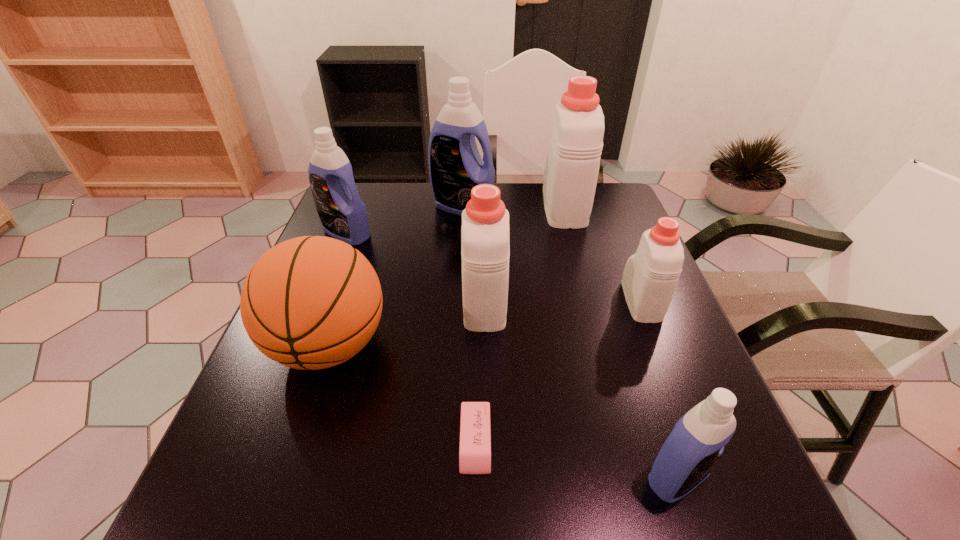
Where is `vacant area that lies between the rightmost white detergent and the second blue detergent from right to left`? The width and height of the screenshot is (960, 540). vacant area that lies between the rightmost white detergent and the second blue detergent from right to left is located at coordinates (552, 254).

Identify the location of free area in between the biggest blue detergent and the leftmost blue detergent. The width and height of the screenshot is (960, 540). (405, 220).

The height and width of the screenshot is (540, 960). What are the coordinates of `vacant area that lies between the second smallest blue detergent and the pink eraser` in the screenshot? It's located at (411, 338).

The image size is (960, 540). In order to click on free space between the rightmost blue detergent and the leftmost white detergent in this screenshot , I will do `click(581, 389)`.

Select which object is the fourth closest to the rightmost white detergent. Please provide its 2D coordinates. Your answer should be formatted as a tuple, i.e. [(x, y)], where the tuple contains the x and y coordinates of a point satisfying the conditions above.

[(475, 436)]

The image size is (960, 540). Find the location of `the second closest object relative to the pink eraser`. the second closest object relative to the pink eraser is located at coordinates (485, 247).

Choose which detergent is the fifth nearest neighbor to the second smallest blue detergent. Please provide its 2D coordinates. Your answer should be formatted as a tuple, i.e. [(x, y)], where the tuple contains the x and y coordinates of a point satisfying the conditions above.

[(697, 441)]

The image size is (960, 540). I want to click on the fourth closest detergent to the biggest white detergent, so click(x=343, y=215).

This screenshot has height=540, width=960. In order to click on white detergent that is the second nearest to the leftmost white detergent in this screenshot , I will do `click(650, 277)`.

Identify which white detergent is the second closest to the shortest object. Please provide its 2D coordinates. Your answer should be formatted as a tuple, i.e. [(x, y)], where the tuple contains the x and y coordinates of a point satisfying the conditions above.

[(650, 277)]